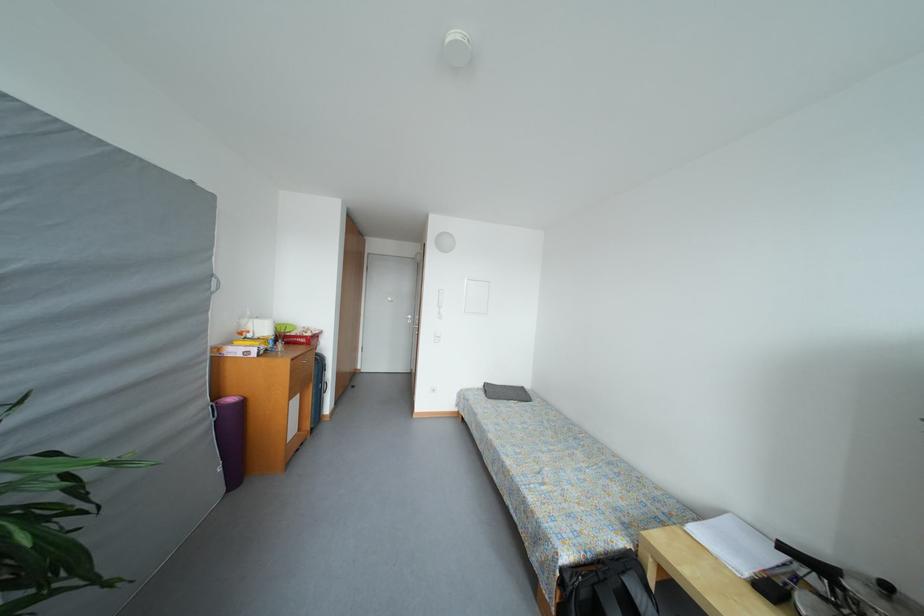
Identify the location of door handle. (563, 485).